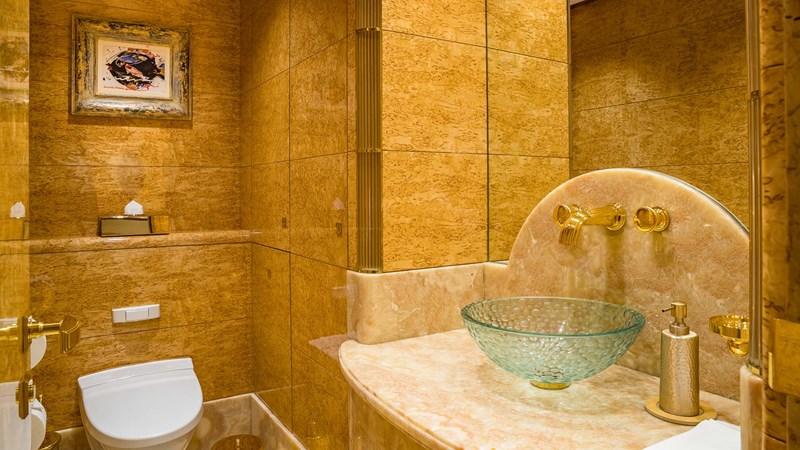
Where is `toilet paper`? toilet paper is located at coordinates (40, 357).